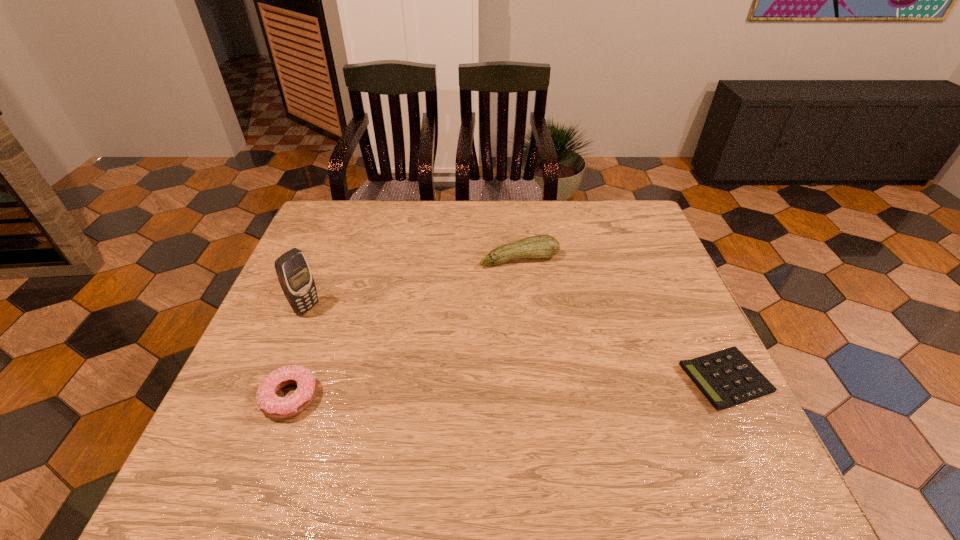
This screenshot has width=960, height=540. Identify the location of the second shortest object. (269, 403).

Locate an element on the screen. calculator is located at coordinates (727, 378).

Where is `the rightmost object`? The image size is (960, 540). the rightmost object is located at coordinates (727, 378).

Locate an element on the screen. cellular telephone is located at coordinates (295, 277).

The width and height of the screenshot is (960, 540). What are the coordinates of `the tallest object` in the screenshot? It's located at (295, 277).

Find the location of `the third object from left to right`. the third object from left to right is located at coordinates (540, 246).

Find the location of a particular element. the third shortest object is located at coordinates (540, 246).

You are a GUI agent. You are given a task and a screenshot of the screen. Output one action in this format:
    pyautogui.click(x=<x>, y=<y>)
    Task: Click on the free location located 0.220m on the right of the doughnut
    
    Given the screenshot: What is the action you would take?
    pyautogui.click(x=422, y=397)

The image size is (960, 540). Identify the location of vacant region located on the left of the rightmost object. (560, 379).

Locate an element on the screen. The height and width of the screenshot is (540, 960). vacant area situated 0.380m on the front face of the tallest object is located at coordinates (437, 380).